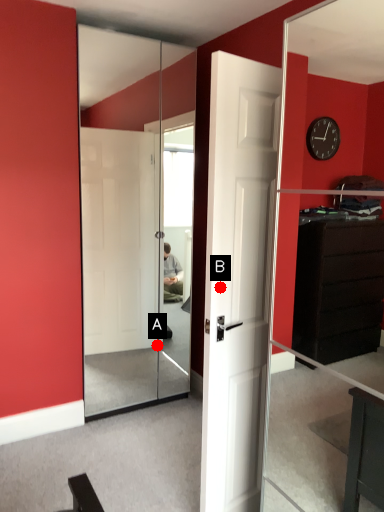
Question: Two points are circled on the image, labeled by A and B beside each circle. Which point is closer to the camera?

Choices:
 (A) A is closer
 (B) B is closer

Answer: (B)